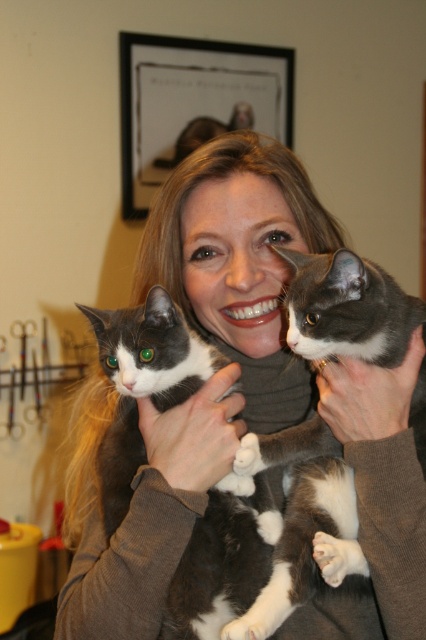
Question: Is matte gray sweater at center closer to the viewer compared to soft gray fur at upper right?

Choices:
 (A) yes
 (B) no

Answer: (B)

Question: Which object appears closest to the camera in this image?

Choices:
 (A) soft gray fur at upper right
 (B) soft gray sweater at center

Answer: (A)

Question: Is matte gray sweater at center positioned before soft gray sweater at center?

Choices:
 (A) no
 (B) yes

Answer: (B)

Question: Which point appears farthest from the camera in this image?

Choices:
 (A) (389, 468)
 (B) (126, 529)
 (C) (196, 449)

Answer: (C)

Question: Which object is farther from the camera taking this photo?

Choices:
 (A) soft gray sweater at center
 (B) soft gray fur at upper right
 (C) matte gray sweater at center

Answer: (A)

Question: Does matte gray sweater at center appear under soft gray sweater at center?

Choices:
 (A) no
 (B) yes

Answer: (A)